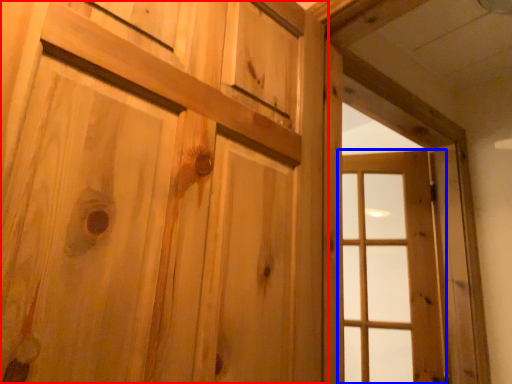
Question: Which object appears farthest to the camera in this image, door (highlighted by a red box) or window (highlighted by a blue box)?

Choices:
 (A) door
 (B) window

Answer: (B)